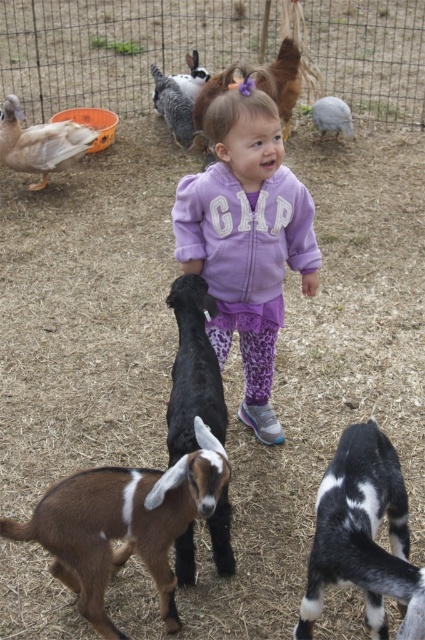
Question: Which is nearer to the black smooth goat at center?

Choices:
 (A) matte white duck at upper left
 (B) black and white fur goat at center
 (C) brown fuzzy goat at lower left

Answer: (C)

Question: Can you confirm if black and white fur goat at center is positioned below black smooth goat at center?

Choices:
 (A) no
 (B) yes

Answer: (B)

Question: Which point is farther to the camera?

Choices:
 (A) (65, 145)
 (B) (334, 122)
 (C) (244, 86)

Answer: (B)

Question: Which point appears closest to the camera in this image?

Choices:
 (A) (42, 177)
 (B) (198, 330)
 (C) (362, 582)
 (D) (252, 157)

Answer: (C)

Question: From the image, what is the correct spatial relationship of black smooth goat at center in relation to matte white duck at upper left?

Choices:
 (A) right
 (B) left

Answer: (A)

Question: Can you confirm if black and white fur goat at center is positioned to the right of black smooth goat at center?

Choices:
 (A) yes
 (B) no

Answer: (A)